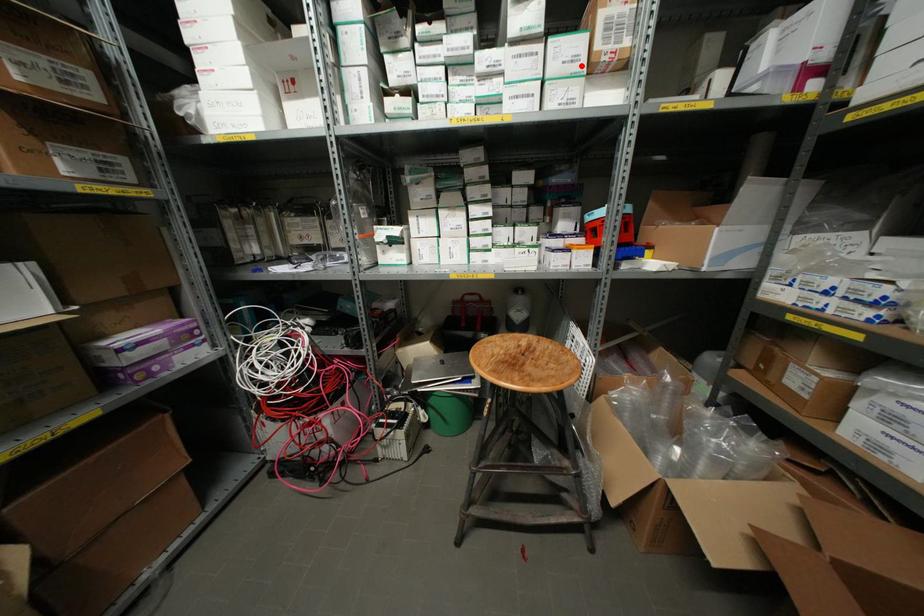
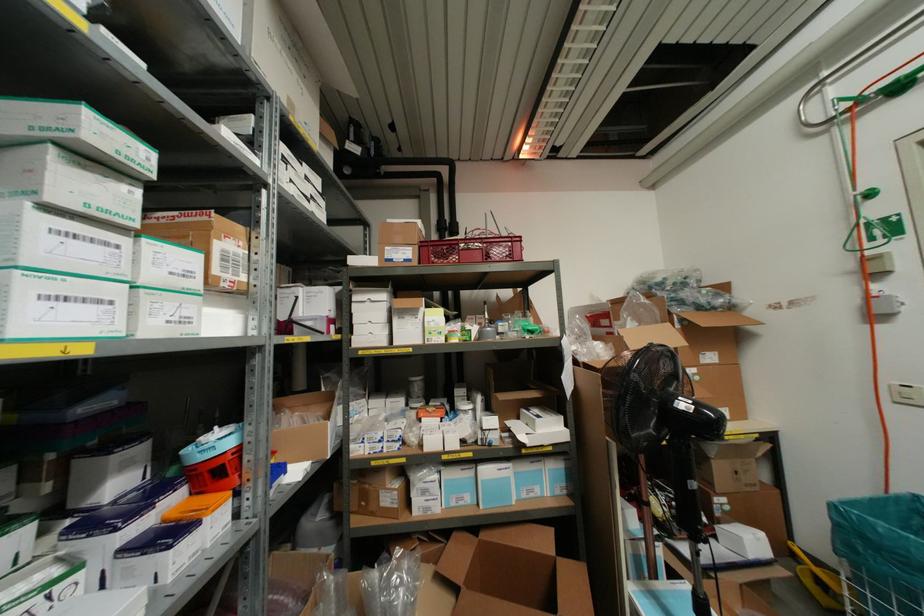
Find the pixel in the second image that matches the highlighted location in the first image.

(196, 283)